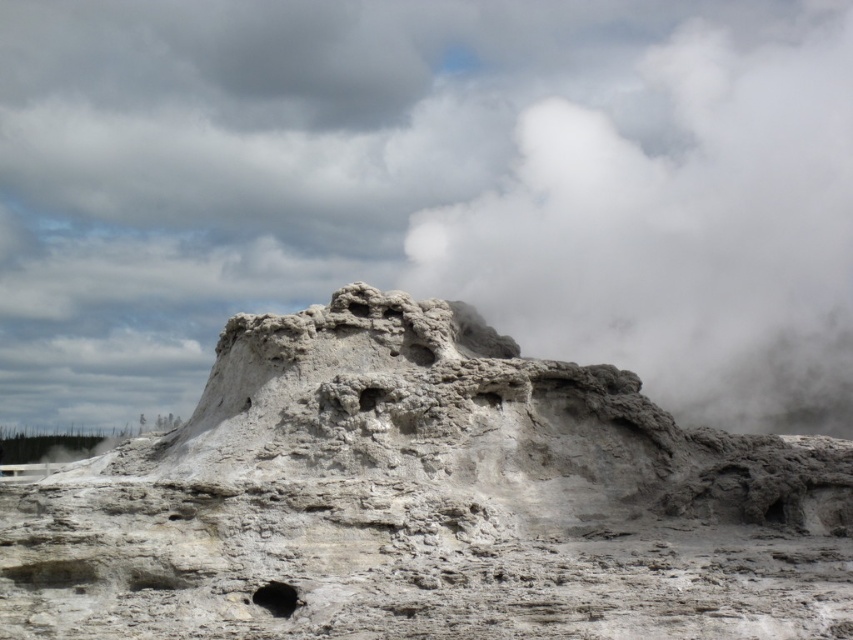
You are an astronomer analyzing the image of the geothermal feature. You need to determine the exact position of the white fluffy cloud at upper center in the image. What are its coordinates?

The white fluffy cloud at upper center is located at coordinates (430, 189).

You are an environmental scientist observing the geothermal site. You notice the white fluffy cloud at upper center and the gray stone rock formation at center. Which one has a greater width?

The white fluffy cloud at upper center has a greater width than the gray stone rock formation at center, as stated in the description.